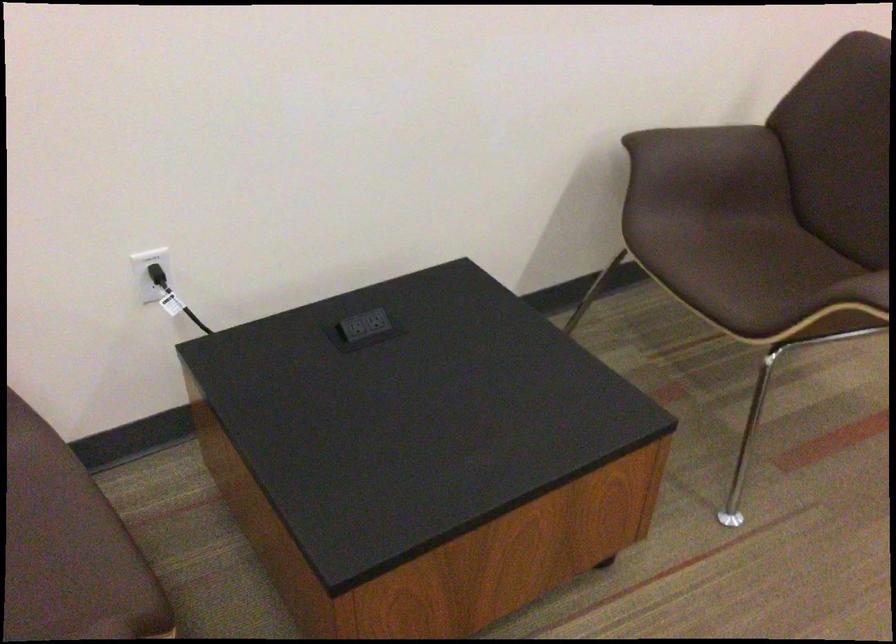
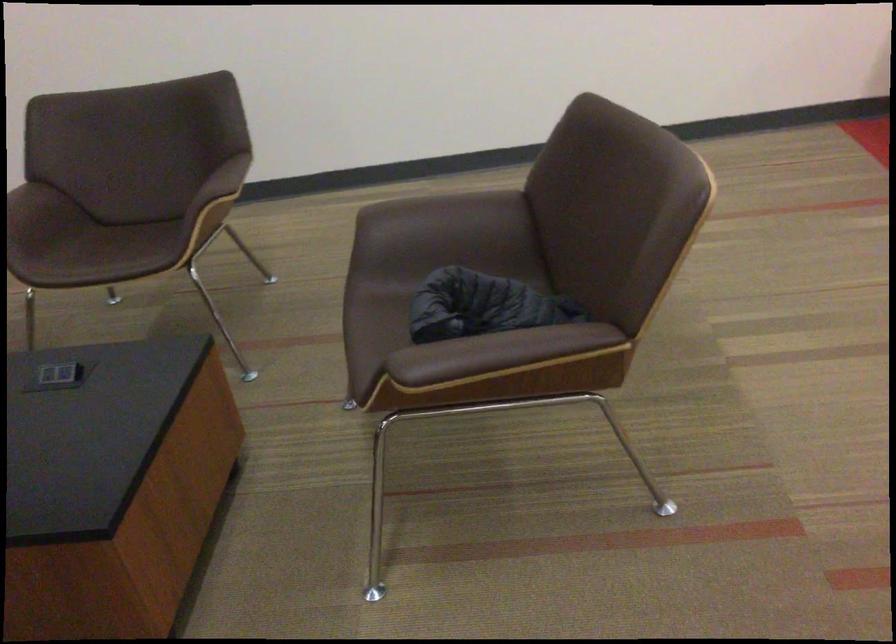
Which direction would the cameraman need to move to produce the second image?

The movement direction of the cameraman is left, backward.